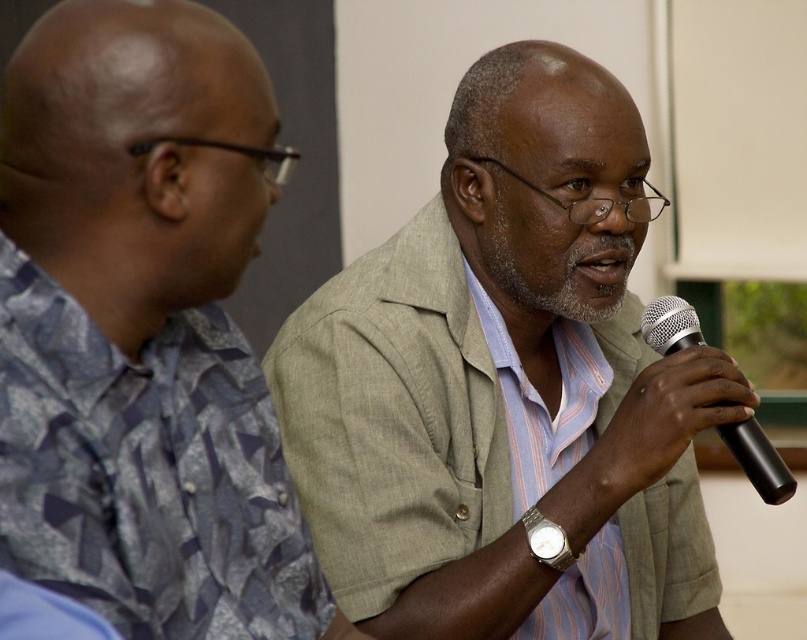
Image resolution: width=807 pixels, height=640 pixels. Describe the element at coordinates (145, 316) in the screenshot. I see `gray fabric shirt at upper right` at that location.

Is gray fabric shirt at upper right below black matte microphone at right?

Indeed, gray fabric shirt at upper right is positioned under black matte microphone at right.

I want to click on gray fabric shirt at upper right, so click(145, 316).

You are a GUI agent. You are given a task and a screenshot of the screen. Output one action in this format:
    pyautogui.click(x=<x>, y=<y>)
    Task: Click on the gray fabric shirt at upper right
    
    Given the screenshot: What is the action you would take?
    pyautogui.click(x=145, y=316)

Between light gray fabric shirt at center and black matte microphone at right, which one has more height?

light gray fabric shirt at center is taller.

Who is positioned more to the left, light gray fabric shirt at center or black matte microphone at right?

From the viewer's perspective, light gray fabric shirt at center appears more on the left side.

I want to click on light gray fabric shirt at center, so tap(508, 388).

Is light gray fabric shirt at center taller than gray fabric shirt at upper right?

Correct, light gray fabric shirt at center is much taller as gray fabric shirt at upper right.

Which is in front, point (500, 493) or point (222, 273)?

Point (222, 273) is in front.

Find the location of a particular element. light gray fabric shirt at center is located at coordinates (508, 388).